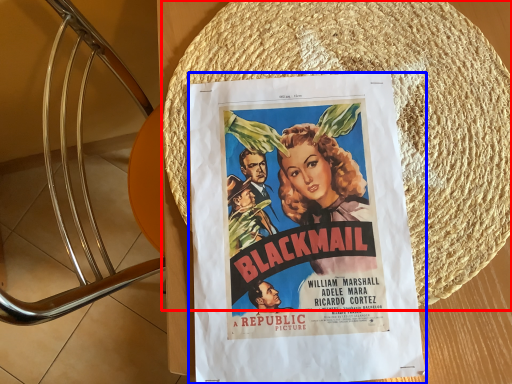
Question: Which of the following is the closest to the observer, straw hat (highlighted by a red box) or poster (highlighted by a blue box)?

Choices:
 (A) straw hat
 (B) poster

Answer: (B)